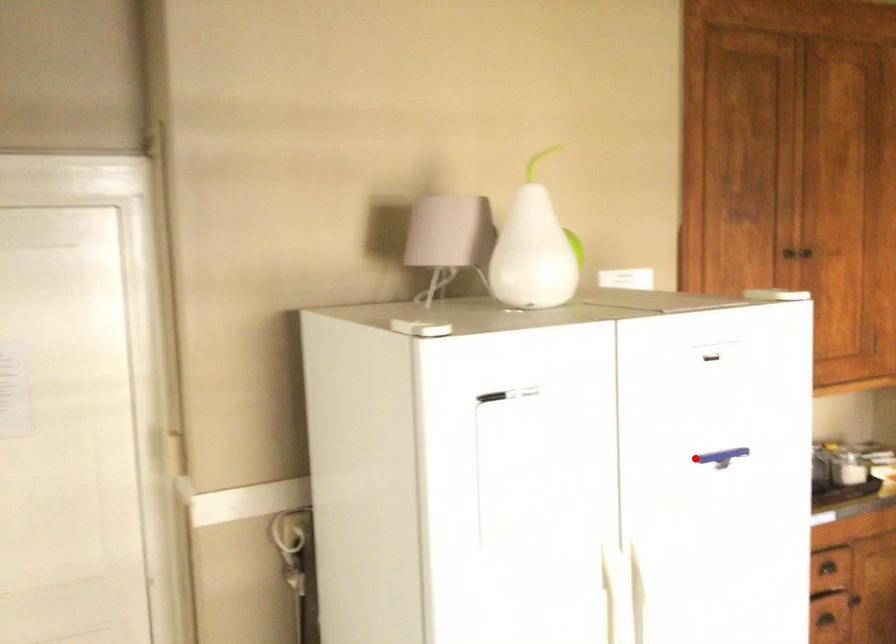
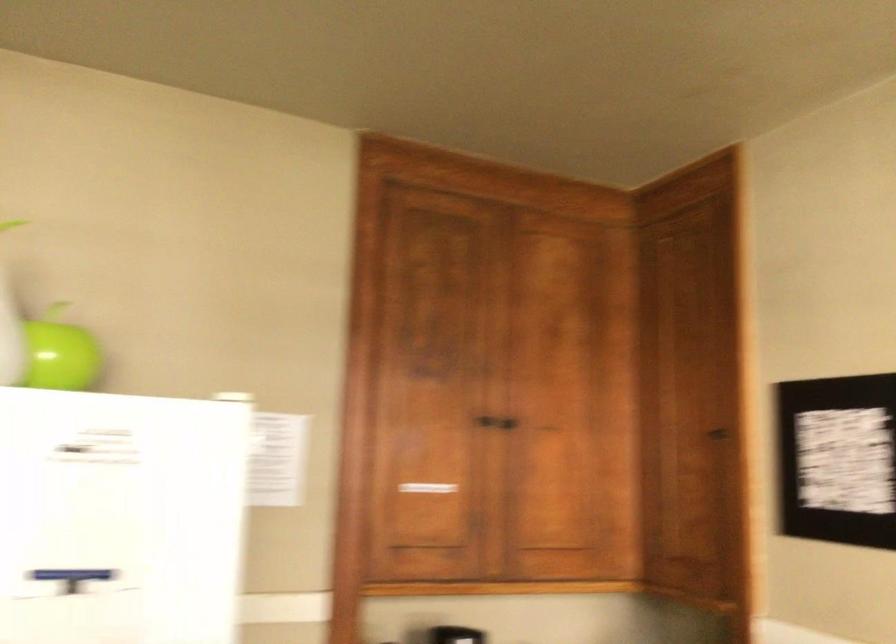
Question: I am providing you with two images of the same scene from different viewpoints. A red point is shown in image1. For the corresponding object point in image2, is it positioned nearer or farther from the camera?

Choices:
 (A) Nearer
 (B) Farther

Answer: (A)